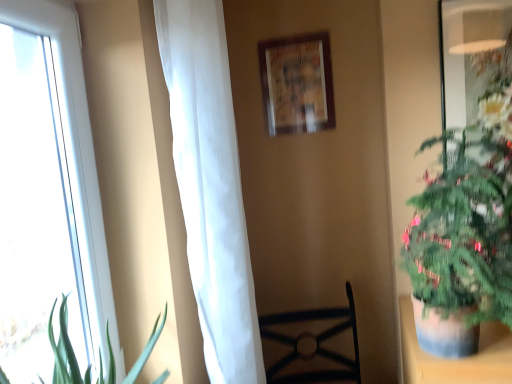
Question: Considering the relative positions of black metal chair at center and green leafy plant at right in the image provided, is black metal chair at center to the left of green leafy plant at right from the viewer's perspective?

Choices:
 (A) no
 (B) yes

Answer: (B)

Question: Is black metal chair at center facing away from green leafy plant at right?

Choices:
 (A) yes
 (B) no

Answer: (B)

Question: Can you confirm if black metal chair at center is thinner than green leafy plant at right?

Choices:
 (A) no
 (B) yes

Answer: (A)

Question: Considering the relative sizes of black metal chair at center and green leafy plant at right in the image provided, is black metal chair at center bigger than green leafy plant at right?

Choices:
 (A) no
 (B) yes

Answer: (B)

Question: Is green leafy plant at right located within black metal chair at center?

Choices:
 (A) yes
 (B) no

Answer: (B)

Question: Considering the relative positions of green leafy plant at right and wooden picture frame at upper center in the image provided, is green leafy plant at right to the left or to the right of wooden picture frame at upper center?

Choices:
 (A) left
 (B) right

Answer: (B)

Question: From a real-world perspective, is green leafy plant at right above or below wooden picture frame at upper center?

Choices:
 (A) above
 (B) below

Answer: (B)

Question: In terms of size, does green leafy plant at right appear bigger or smaller than wooden picture frame at upper center?

Choices:
 (A) big
 (B) small

Answer: (A)

Question: Relative to wooden picture frame at upper center, is green leafy plant at right in front or behind?

Choices:
 (A) front
 (B) behind

Answer: (A)

Question: In the image, is white glass window at left positioned in front of or behind wooden picture frame at upper center?

Choices:
 (A) front
 (B) behind

Answer: (A)

Question: From their relative heights in the image, would you say white glass window at left is taller or shorter than wooden picture frame at upper center?

Choices:
 (A) short
 (B) tall

Answer: (B)

Question: Which is correct: white glass window at left is inside wooden picture frame at upper center, or outside of it?

Choices:
 (A) inside
 (B) outside

Answer: (B)

Question: From the image's perspective, is white glass window at left positioned above or below wooden picture frame at upper center?

Choices:
 (A) below
 (B) above

Answer: (A)

Question: Considering the positions of point click(194, 120) and point click(78, 139), is point click(194, 120) closer or farther from the camera than point click(78, 139)?

Choices:
 (A) farther
 (B) closer

Answer: (B)

Question: Considering the relative positions of white sheer curtain at left and white glass window at left in the image provided, is white sheer curtain at left to the left or to the right of white glass window at left?

Choices:
 (A) left
 (B) right

Answer: (B)